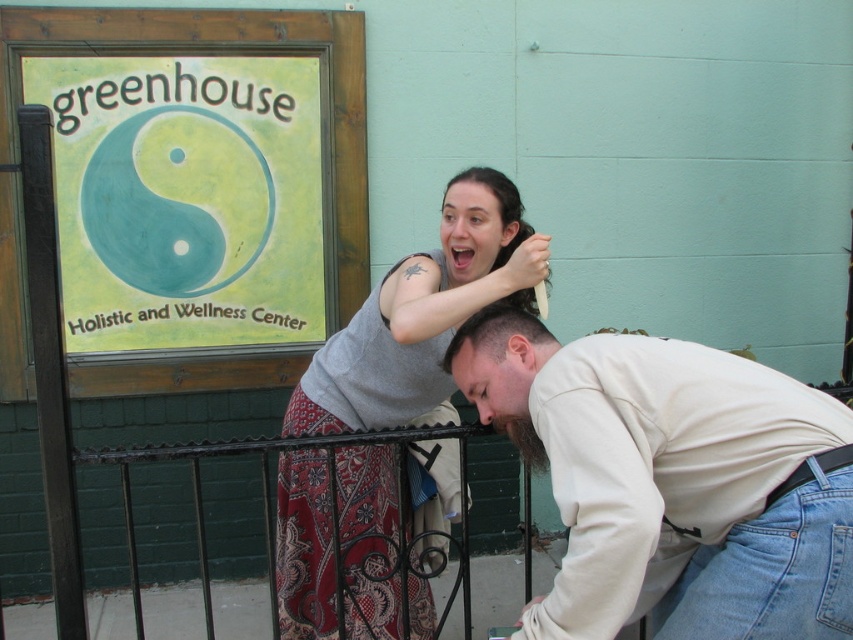
Does beige cotton shirt at lower right have a lesser height compared to dark brown hair at upper center?

No, beige cotton shirt at lower right is not shorter than dark brown hair at upper center.

What do you see at coordinates (672, 481) in the screenshot? The width and height of the screenshot is (853, 640). I see `beige cotton shirt at lower right` at bounding box center [672, 481].

What are the coordinates of `beige cotton shirt at lower right` in the screenshot? It's located at (672, 481).

Can you confirm if gray fabric shirt at center is positioned to the right of dark brown hair at upper center?

Incorrect, gray fabric shirt at center is not on the right side of dark brown hair at upper center.

Who is more distant from viewer, (306, 588) or (451, 339)?

The point (306, 588) is more distant.

Image resolution: width=853 pixels, height=640 pixels. Find the location of `gray fabric shirt at center`. gray fabric shirt at center is located at coordinates (421, 314).

Who is taller, beige cotton shirt at lower right or gray fabric shirt at center?

Standing taller between the two is gray fabric shirt at center.

Who is higher up, beige cotton shirt at lower right or gray fabric shirt at center?

gray fabric shirt at center is higher up.

The image size is (853, 640). Describe the element at coordinates (672, 481) in the screenshot. I see `beige cotton shirt at lower right` at that location.

You are a GUI agent. You are given a task and a screenshot of the screen. Output one action in this format:
    pyautogui.click(x=<x>, y=<y>)
    Task: Click on the beige cotton shirt at lower right
    The image size is (853, 640).
    Given the screenshot: What is the action you would take?
    pyautogui.click(x=672, y=481)